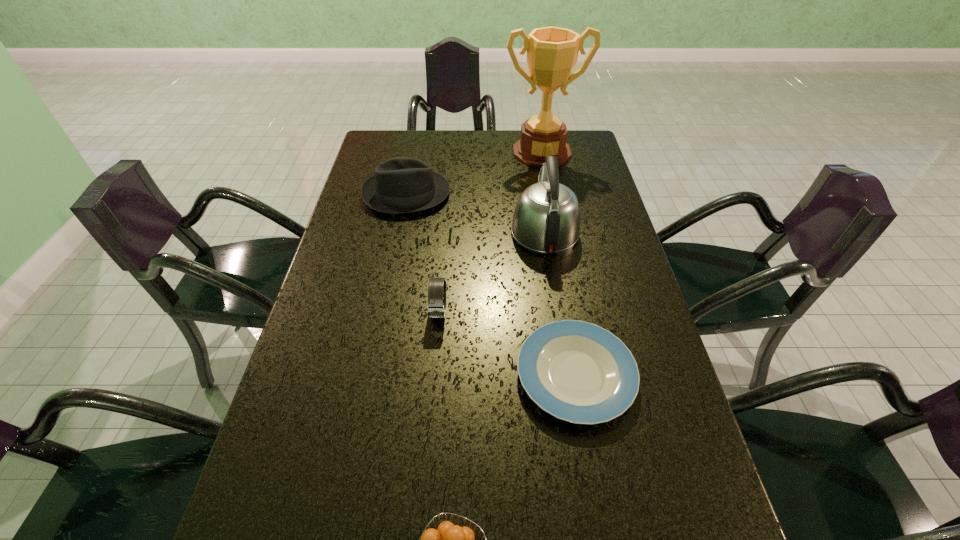
Find the location of a particular element. The height and width of the screenshot is (540, 960). the tallest object is located at coordinates (552, 52).

The width and height of the screenshot is (960, 540). Find the location of `award`. award is located at coordinates (552, 52).

The height and width of the screenshot is (540, 960). In order to click on the fifth shortest object in this screenshot , I will do `click(546, 219)`.

At what (x,y) coordinates should I click in order to perform the action: click on fedora. Please return your answer as a coordinate pair (x, y). Looking at the image, I should click on (400, 185).

Find the location of a particular element. the fourth tallest object is located at coordinates (436, 305).

I want to click on watch, so click(436, 305).

Identify the location of the shortest object. (579, 372).

Where is `the second nearest object`? This screenshot has width=960, height=540. the second nearest object is located at coordinates (579, 372).

This screenshot has width=960, height=540. What are the coordinates of `vacant area situated 0.370m on the front-facing side of the tallest object` in the screenshot? It's located at (558, 238).

You are a GUI agent. You are given a task and a screenshot of the screen. Output one action in this format:
    pyautogui.click(x=<x>, y=<y>)
    Task: Click on the free location located 0.090m on the spout of the fifth shortest object
    Image resolution: width=960 pixels, height=540 pixels.
    Given the screenshot: What is the action you would take?
    pyautogui.click(x=538, y=188)